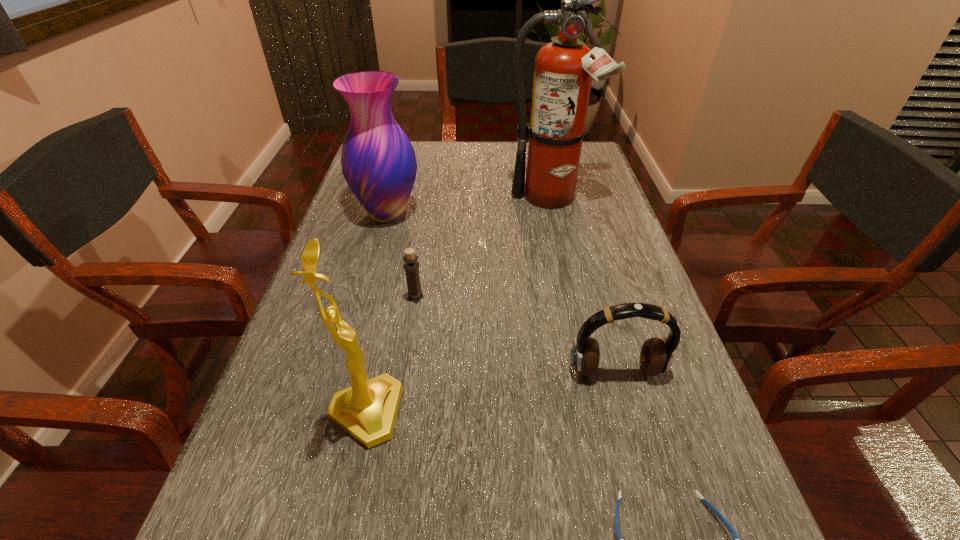
I want to click on vacant region located on the back of the fifth tallest object, so click(x=428, y=217).

Identify the location of vase that is positioned at the left edge. (378, 161).

You are a GUI agent. You are given a task and a screenshot of the screen. Output one action in this format:
    pyautogui.click(x=<x>, y=<y>)
    Task: Click on the award positioned at the left edge
    The width and height of the screenshot is (960, 540).
    Given the screenshot: What is the action you would take?
    pyautogui.click(x=367, y=410)

Find the location of a particular element. Image resolution: width=960 pixels, height=540 pixels. fire extinguisher positioned at the right edge is located at coordinates (564, 68).

You are a GUI agent. You are given a task and a screenshot of the screen. Output one action in this format:
    pyautogui.click(x=<x>, y=<y>)
    Task: Click on the headset that is at the right edge
    
    Given the screenshot: What is the action you would take?
    pyautogui.click(x=656, y=356)

At what (x,y) coordinates should I click in order to perform the action: click on blank space at the far edge. Please return your answer as a coordinate pair (x, y). Looking at the image, I should click on (498, 158).

Locate an element on the screen. vacant space at the left edge of the desktop is located at coordinates (336, 293).

You are a GUI agent. You are given a task and a screenshot of the screen. Output one action in this format:
    pyautogui.click(x=<x>, y=<y>)
    Task: Click on the vacant space at the right edge of the desktop
    
    Given the screenshot: What is the action you would take?
    pos(612,286)

Where is `vacant area at the far right corner of the desktop`? The width and height of the screenshot is (960, 540). vacant area at the far right corner of the desktop is located at coordinates (593, 163).

Where is `free space that is in between the vase and the award`? free space that is in between the vase and the award is located at coordinates (376, 313).